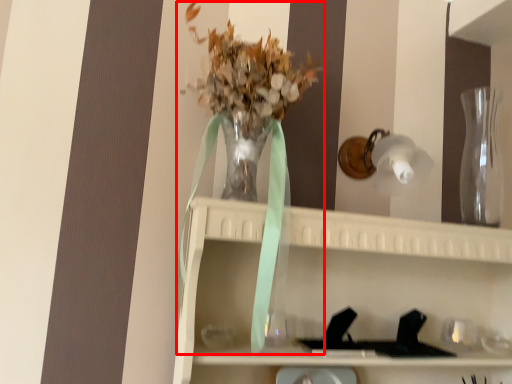
Question: From the image's perspective, where is floral arrangement (annotated by the red box) located in relation to glass vase in the image?

Choices:
 (A) above
 (B) below

Answer: (B)